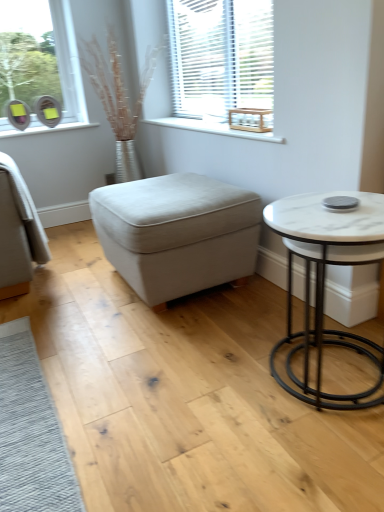
Question: In the image, is beige fabric ottoman at center on the left side or the right side of white marble table at right?

Choices:
 (A) left
 (B) right

Answer: (A)

Question: From the image's perspective, is beige fabric ottoman at center located above or below white marble table at right?

Choices:
 (A) above
 (B) below

Answer: (A)

Question: Which object is the closest to the beige fabric ottoman at center?

Choices:
 (A) white marble table at right
 (B) white wooden blinds at upper center
 (C) white wood at upper center

Answer: (C)

Question: Estimate the real-world distances between objects in this image. Which object is closer to the white wood at upper center?

Choices:
 (A) beige fabric ottoman at center
 (B) white marble table at right
 (C) white wooden blinds at upper center

Answer: (C)